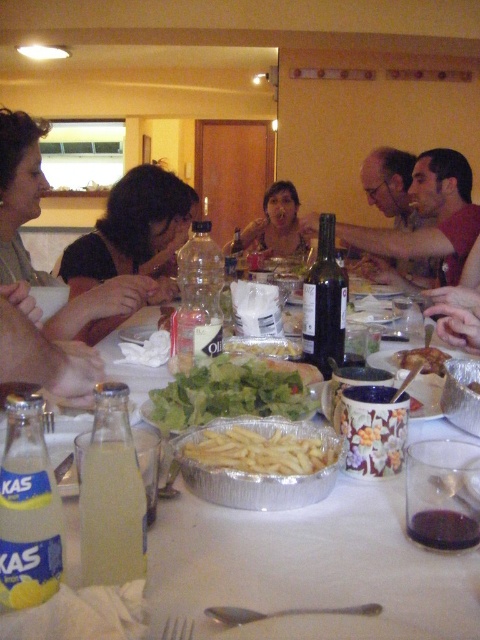
Question: Which of these objects is positioned closest to the matte black wine bottle at center?

Choices:
 (A) translucent plastic bottle at center
 (B) silver aluminum tray at center
 (C) clear glass bottle at lower left
 (D) green leafy salad at center

Answer: (A)

Question: Does silver aluminum tray at center have a larger size compared to matte black shirt at upper left?

Choices:
 (A) yes
 (B) no

Answer: (B)

Question: Which object is the farthest from the matte black wine bottle at center?

Choices:
 (A) clear glass bottle at lower left
 (B) golden crispy fries at center
 (C) matte skin at center
 (D) silver aluminum tray at center

Answer: (A)

Question: Can you confirm if clear plastic bottle at center is wider than dark glass bottle at center?

Choices:
 (A) no
 (B) yes

Answer: (B)

Question: Which object appears farthest from the camera in this image?

Choices:
 (A) matte black shirt at upper left
 (B) yellow glass bottle at lower left

Answer: (A)

Question: Is clear glass bottle at lower left to the left of dark brown hair at upper left from the viewer's perspective?

Choices:
 (A) yes
 (B) no

Answer: (B)